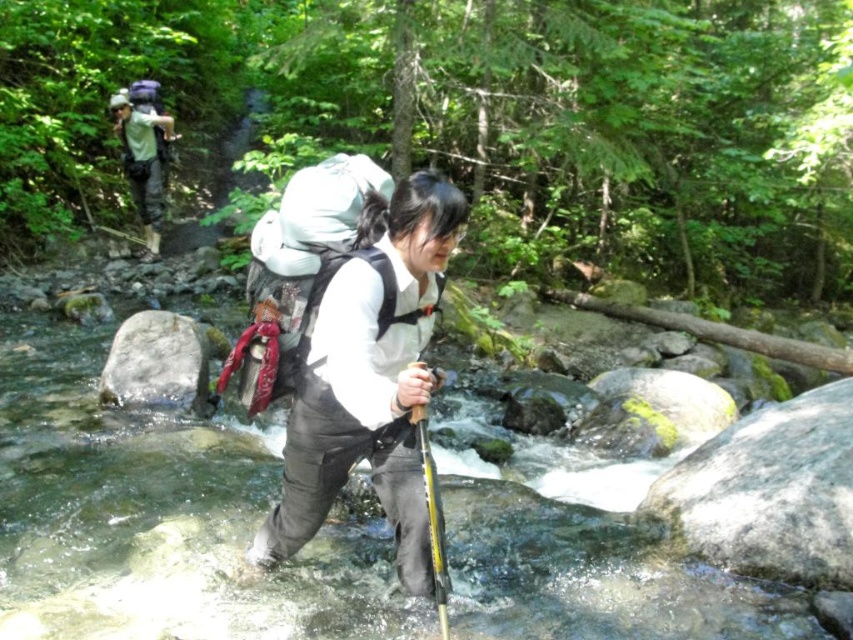
This screenshot has width=853, height=640. What do you see at coordinates (157, 362) in the screenshot?
I see `gray rough rock at center` at bounding box center [157, 362].

Does point (195, 352) come in front of point (158, 188)?

Yes.

Which is in front, point (160, 376) or point (149, 189)?

Point (160, 376) is more forward.

Find the location of a particular element. Image resolution: width=853 pixels, height=640 pixels. gray rough rock at center is located at coordinates (157, 362).

Does matte gray backpack at center have a greater height compared to gray rough rock at center?

Indeed, matte gray backpack at center has a greater height compared to gray rough rock at center.

This screenshot has height=640, width=853. Describe the element at coordinates (368, 372) in the screenshot. I see `matte gray backpack at center` at that location.

The image size is (853, 640). I want to click on matte gray backpack at center, so click(368, 372).

From the picture: Who is positioned more to the right, white matte backpack at center or gray rough rock at center?

white matte backpack at center

Is white matte backpack at center taller than gray rough rock at center?

Yes, white matte backpack at center is taller than gray rough rock at center.

Locate an element on the screen. The image size is (853, 640). white matte backpack at center is located at coordinates (294, 268).